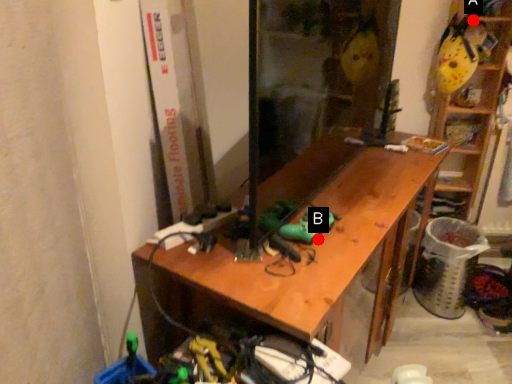
Question: Two points are circled on the image, labeled by A and B beside each circle. Which point is farther to the camera?

Choices:
 (A) A is further
 (B) B is further

Answer: (A)